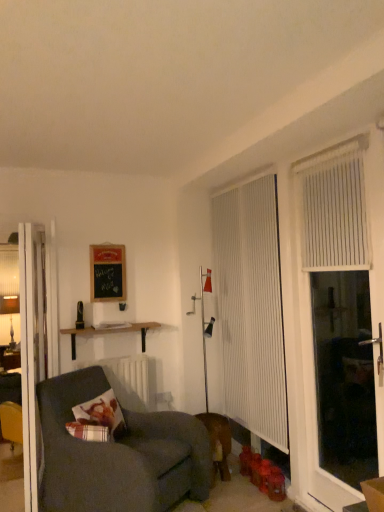
Question: Does dark gray fabric couch at lower left appear on the left side of black chalkboard at upper left?

Choices:
 (A) no
 (B) yes

Answer: (A)

Question: Does dark gray fabric couch at lower left come behind black chalkboard at upper left?

Choices:
 (A) yes
 (B) no

Answer: (B)

Question: Is dark gray fabric couch at lower left at the right side of black chalkboard at upper left?

Choices:
 (A) yes
 (B) no

Answer: (A)

Question: Is dark gray fabric couch at lower left bigger than black chalkboard at upper left?

Choices:
 (A) yes
 (B) no

Answer: (A)

Question: Is dark gray fabric couch at lower left next to black chalkboard at upper left and touching it?

Choices:
 (A) no
 (B) yes

Answer: (A)

Question: Is point (109, 398) positioned closer to the camera than point (236, 224)?

Choices:
 (A) closer
 (B) farther

Answer: (A)

Question: From their relative heights in the image, would you say plaid fabric pillow at lower left is taller or shorter than white vertical blinds at right, positioned as the 1th curtain in back-to-front order?

Choices:
 (A) short
 (B) tall

Answer: (A)

Question: Is plaid fabric pillow at lower left to the left or to the right of white vertical blinds at right, which is the 1th curtain in left-to-right order, in the image?

Choices:
 (A) right
 (B) left

Answer: (B)

Question: Choose the correct answer: Is plaid fabric pillow at lower left inside white vertical blinds at right, which is the 1th curtain in left-to-right order, or outside it?

Choices:
 (A) outside
 (B) inside

Answer: (A)

Question: Considering their positions, is white vertical blinds at right, which ranks as the second curtain in right-to-left order, located in front of or behind dark gray fabric couch at lower left?

Choices:
 (A) behind
 (B) front

Answer: (A)

Question: Looking at the image, does white vertical blinds at right, which is the second curtain in front-to-back order, seem bigger or smaller compared to dark gray fabric couch at lower left?

Choices:
 (A) big
 (B) small

Answer: (B)

Question: Considering the relative positions of white vertical blinds at right, which is the second curtain in front-to-back order, and dark gray fabric couch at lower left in the image provided, is white vertical blinds at right, which is the second curtain in front-to-back order, to the left or to the right of dark gray fabric couch at lower left?

Choices:
 (A) right
 (B) left

Answer: (A)

Question: Does point (281, 399) appear closer or farther from the camera than point (44, 417)?

Choices:
 (A) farther
 (B) closer

Answer: (A)

Question: In the image, is dark gray fabric couch at lower left on the left side or the right side of white glossy door at left?

Choices:
 (A) left
 (B) right

Answer: (B)

Question: Is point [87, 389] closer or farther from the camera than point [36, 305]?

Choices:
 (A) closer
 (B) farther

Answer: (A)